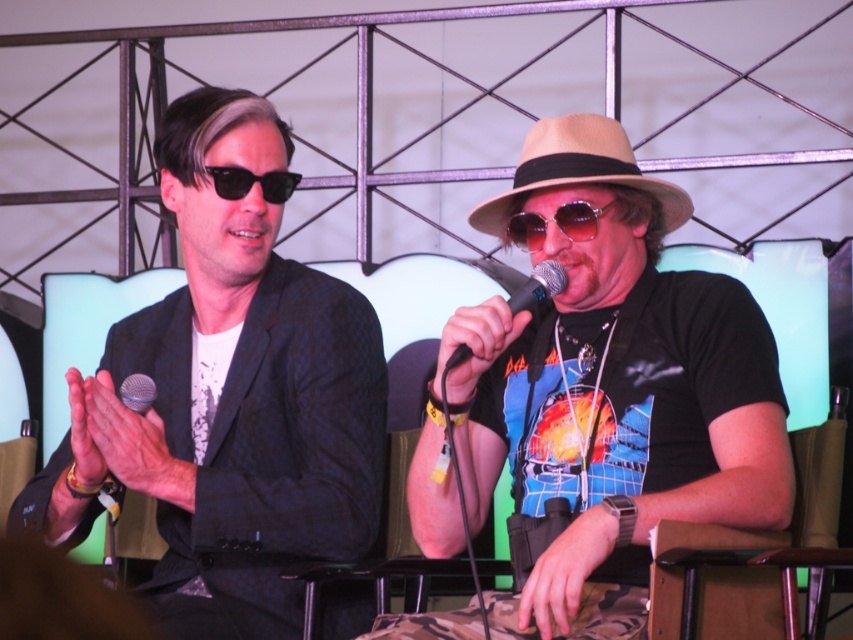
Question: Estimate the real-world distances between objects in this image. Which object is closer to the black reflective sunglasses at left?

Choices:
 (A) shiny purple goggles at center
 (B) shiny black microphone at center

Answer: (A)

Question: Which object appears closest to the camera in this image?

Choices:
 (A) brown leather chair at lower right
 (B) shiny purple goggles at center
 (C) black matte microphone at center
 (D) black reflective sunglasses at left

Answer: (A)

Question: Is shiny black microphone at center further to the viewer compared to black reflective sunglasses at left?

Choices:
 (A) no
 (B) yes

Answer: (A)

Question: Which point is closer to the camera?

Choices:
 (A) matte black suit at left
 (B) black reflective sunglasses at left
 (C) tan straw fedora at center
 (D) brown leather chair at lower right

Answer: (D)

Question: Is shiny black microphone at center smaller than brown leather chair at lower right?

Choices:
 (A) yes
 (B) no

Answer: (B)

Question: Where is brown leather chair at lower right located in relation to tan straw fedora at center in the image?

Choices:
 (A) below
 (B) above

Answer: (A)